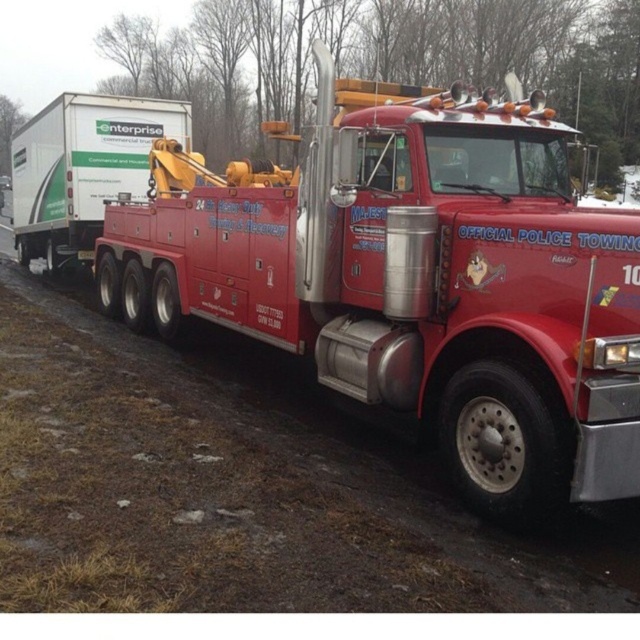
Is shiny red tow truck at center in front of white matte trailer at left?

Yes.

Is shiny red tow truck at center wider than white matte trailer at left?

No.

What do you see at coordinates (413, 280) in the screenshot? I see `shiny red tow truck at center` at bounding box center [413, 280].

Find the location of `shiny red tow truck at center`. shiny red tow truck at center is located at coordinates (413, 280).